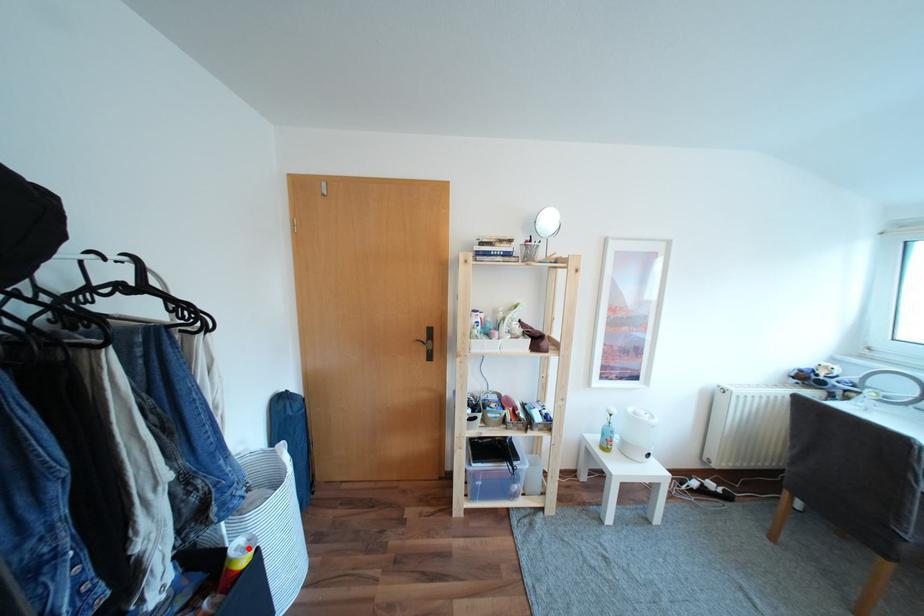
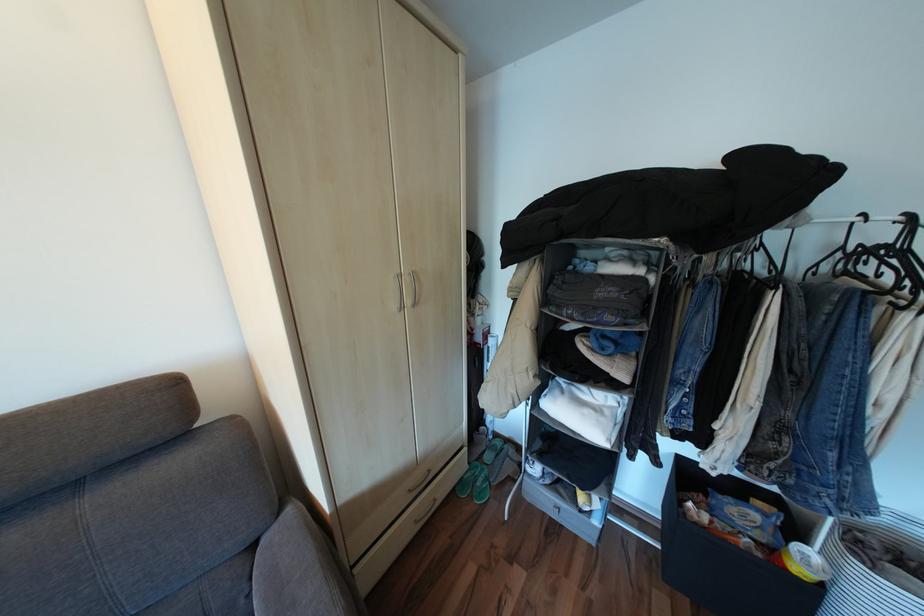
Question: I am providing you with two images of the same scene from different viewpoints. Image1 has a red point marked. In image2, the corresponding 3D location appears at what relative position? Reply with the corresponding letter.

Choices:
 (A) Closer
 (B) Farther

Answer: (A)